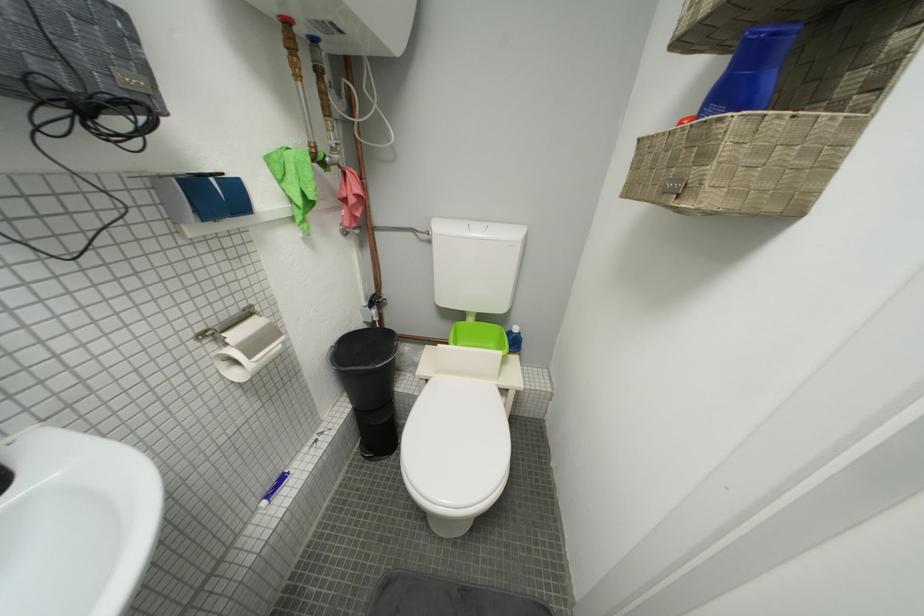
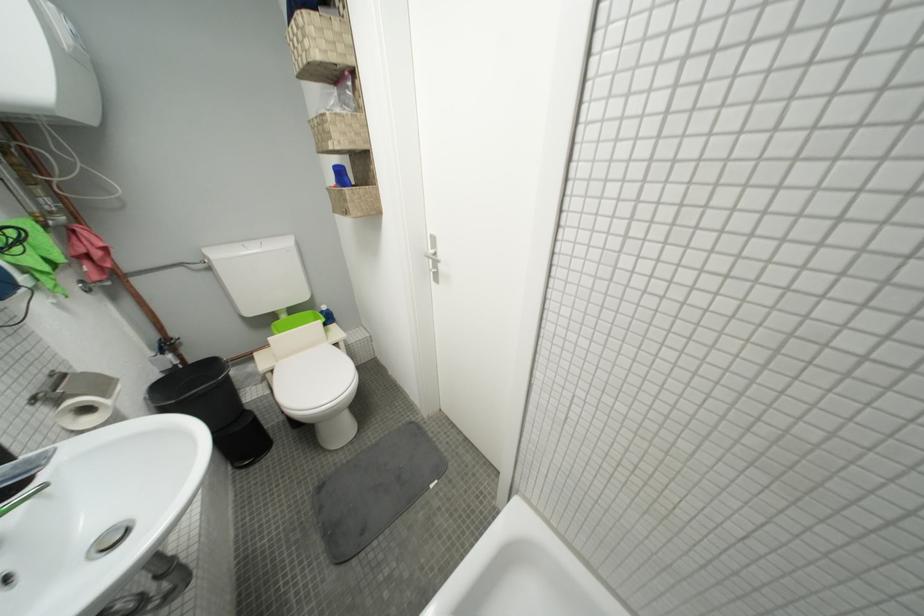
In the second image, find the point that corresponds to the point at 435,383 in the first image.

(281, 373)